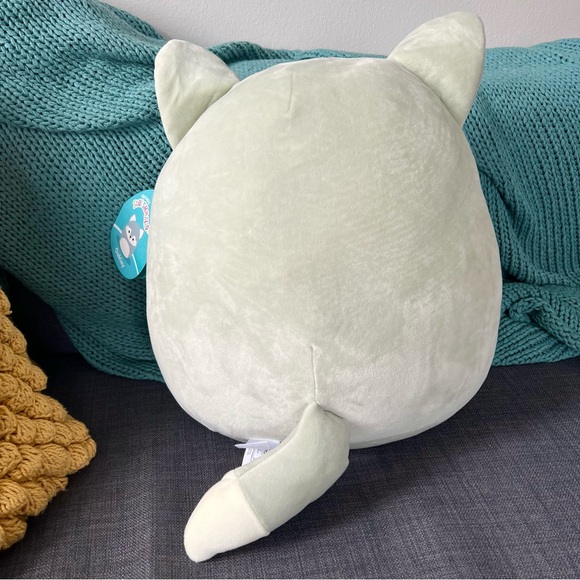
This screenshot has height=580, width=580. I want to click on blue rugh, so click(74, 169).